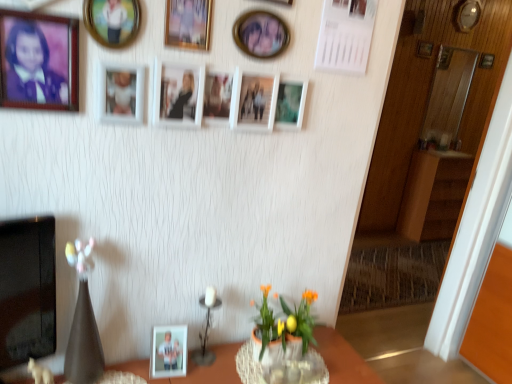
Question: From the image's perspective, is matte white photo frame at lower center, which is the tenth picture frame in right-to-left order, located above or below white matte picture frame at center, which is the 8th picture frame from left to right?

Choices:
 (A) below
 (B) above

Answer: (A)

Question: Is matte white photo frame at lower center, which is counted as the 4th picture frame, starting from the left, to the left or to the right of white matte picture frame at center, placed as the sixth picture frame when sorted from back to front, in the image?

Choices:
 (A) right
 (B) left

Answer: (B)

Question: Which object is the farthest from the matte black vase at left?

Choices:
 (A) white matte picture frame at center, the 8th picture frame when ordered from front to back
 (B) brown wood dresser at right
 (C) matte white photo frame at center, the third picture frame positioned from the bottom
 (D) wooden picture frame at upper right, the first picture frame in the back-to-front sequence
 (E) orange artificial flowers at lower center

Answer: (D)

Question: Which object is the closest to the orange artificial flowers at lower center?

Choices:
 (A) clear glass vase at lower center
 (B) wooden picture frame at upper right, the first picture frame in the back-to-front sequence
 (C) wooden picture frame at upper center, the 5th picture frame positioned from the top
 (D) metallic circular frame at upper left, the 2th picture frame in the front-to-back sequence
 (E) matte wooden picture frame at center, the eighth picture frame from the top

Answer: (A)